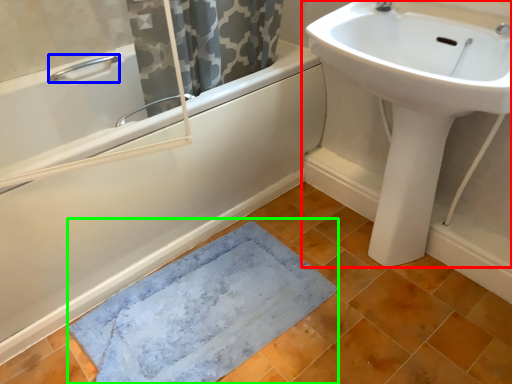
Question: Which object is the closest to the sink (highlighted by a red box)? Choose among these: plumbing fixture (highlighted by a blue box) or bath mat (highlighted by a green box).

Choices:
 (A) plumbing fixture
 (B) bath mat

Answer: (B)